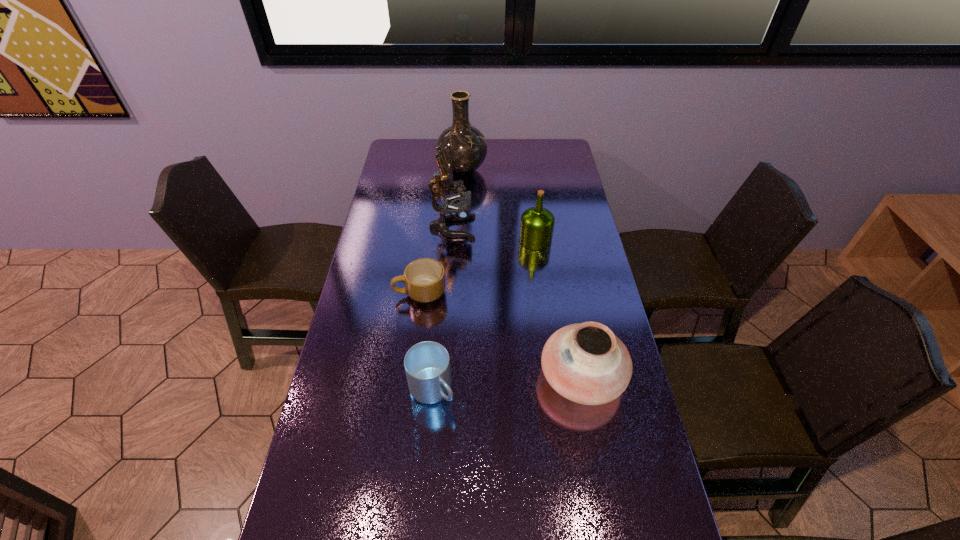
This screenshot has width=960, height=540. Find the location of `vacant space at the left edge of the desktop`. vacant space at the left edge of the desktop is located at coordinates (418, 185).

In the image, there is a desktop. Identify the location of vacant space at the right edge. (633, 495).

This screenshot has width=960, height=540. I want to click on free space at the far left corner, so click(415, 153).

The height and width of the screenshot is (540, 960). I want to click on vacant space at the far right corner of the desktop, so click(x=539, y=154).

Where is `empty location between the microscope and the taller mug`? empty location between the microscope and the taller mug is located at coordinates (x=443, y=309).

At what (x,y) coordinates should I click in order to perform the action: click on unoccupied position between the olive oil and the pottery. Please return your answer as a coordinate pair (x, y). Looking at the image, I should click on (559, 308).

At what (x,y) coordinates should I click in order to perform the action: click on vacant area between the farther mug and the olive oil. Please return your answer as a coordinate pair (x, y). Looking at the image, I should click on (478, 266).

Identify the location of blank region between the microscope and the pottery. (517, 302).

The width and height of the screenshot is (960, 540). In order to click on vacant region between the nearer mug and the fourth tallest object in this screenshot , I will do `click(507, 383)`.

Identify which object is located as the second nearest to the farther mug. Please provide its 2D coordinates. Your answer should be formatted as a tuple, i.e. [(x, y)], where the tuple contains the x and y coordinates of a point satisfying the conditions above.

[(427, 364)]